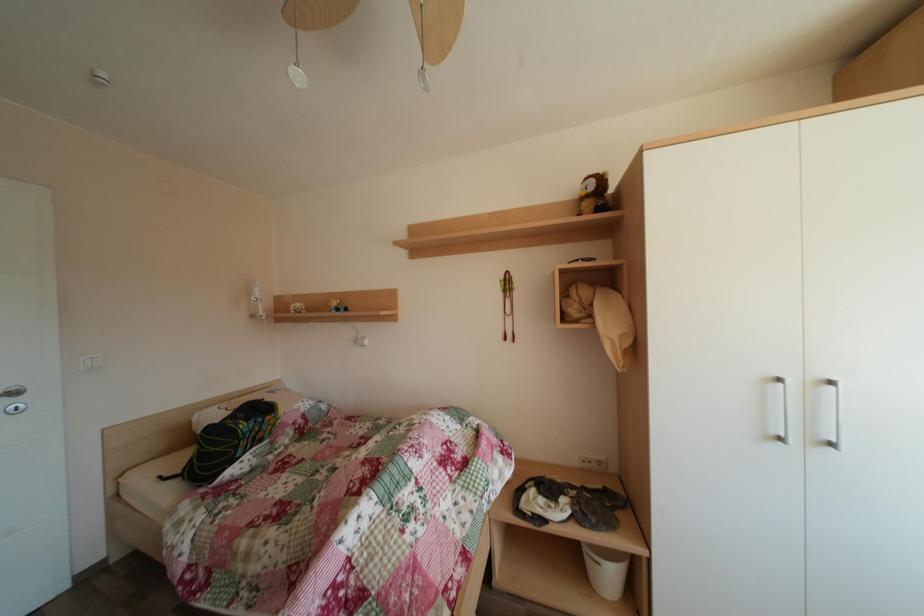
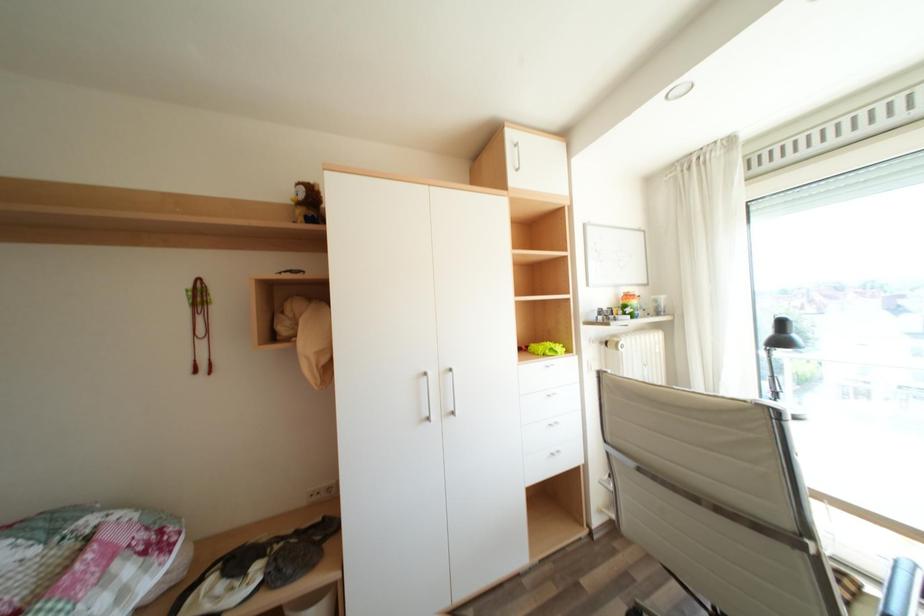
Question: The camera is either moving clockwise (left) or counter-clockwise (right) around the object. The first image is from the beginning of the video and the second image is from the end. Is the camera moving left or right when shooting the video?

Choices:
 (A) Left
 (B) Right

Answer: (A)